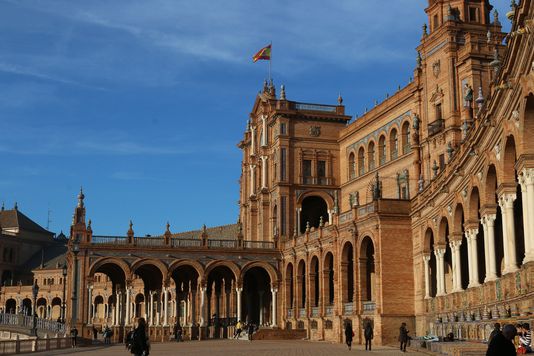
The height and width of the screenshot is (356, 534). Identify the location of brown pillars. (358, 280), (340, 279), (321, 282), (308, 283), (296, 284), (286, 285).